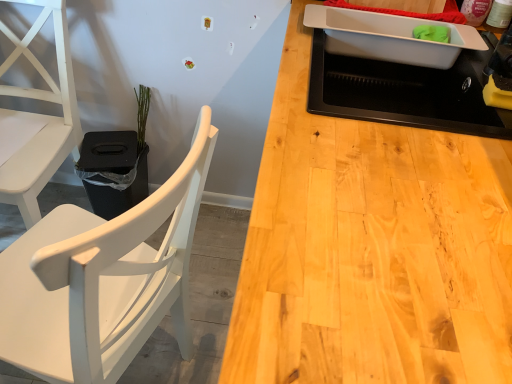
Question: From a real-world perspective, is green matte plant at upper left beneath black plastic houseplant at left?

Choices:
 (A) no
 (B) yes

Answer: (A)

Question: From the image's perspective, would you say green matte plant at upper left is positioned over black plastic houseplant at left?

Choices:
 (A) no
 (B) yes

Answer: (B)

Question: Considering the relative sizes of green matte plant at upper left and black plastic houseplant at left in the image provided, is green matte plant at upper left taller than black plastic houseplant at left?

Choices:
 (A) yes
 (B) no

Answer: (B)

Question: Is green matte plant at upper left shorter than black plastic houseplant at left?

Choices:
 (A) yes
 (B) no

Answer: (A)

Question: Would you consider green matte plant at upper left to be distant from black plastic houseplant at left?

Choices:
 (A) no
 (B) yes

Answer: (A)

Question: Considering the positions of white matte wood chair at left, marked as the 2th chair in a left-to-right arrangement, and black plastic houseplant at left in the image, is white matte wood chair at left, marked as the 2th chair in a left-to-right arrangement, wider or thinner than black plastic houseplant at left?

Choices:
 (A) wide
 (B) thin

Answer: (A)

Question: Do you think white matte wood chair at left, the first chair when ordered from right to left, is within black plastic houseplant at left, or outside of it?

Choices:
 (A) inside
 (B) outside

Answer: (B)

Question: Is point (193, 211) positioned closer to the camera than point (133, 160)?

Choices:
 (A) closer
 (B) farther

Answer: (A)

Question: From a real-world perspective, is white matte wood chair at left, marked as the 2th chair in a left-to-right arrangement, above or below black plastic houseplant at left?

Choices:
 (A) below
 (B) above

Answer: (B)

Question: Visually, is black matte sink at upper right positioned to the left or to the right of black plastic houseplant at left?

Choices:
 (A) right
 (B) left

Answer: (A)

Question: From a real-world perspective, relative to black plastic houseplant at left, is black matte sink at upper right vertically above or below?

Choices:
 (A) above
 (B) below

Answer: (A)

Question: Looking at their shapes, would you say black matte sink at upper right is wider or thinner than black plastic houseplant at left?

Choices:
 (A) thin
 (B) wide

Answer: (B)

Question: From the image's perspective, is black matte sink at upper right positioned above or below black plastic houseplant at left?

Choices:
 (A) above
 (B) below

Answer: (A)

Question: Would you say black plastic houseplant at left is inside or outside white matte wood chair at left, the first chair when ordered from right to left?

Choices:
 (A) inside
 (B) outside

Answer: (B)

Question: Considering the positions of black plastic houseplant at left and white matte wood chair at left, the first chair when ordered from right to left, in the image, is black plastic houseplant at left bigger or smaller than white matte wood chair at left, the first chair when ordered from right to left,?

Choices:
 (A) small
 (B) big

Answer: (A)